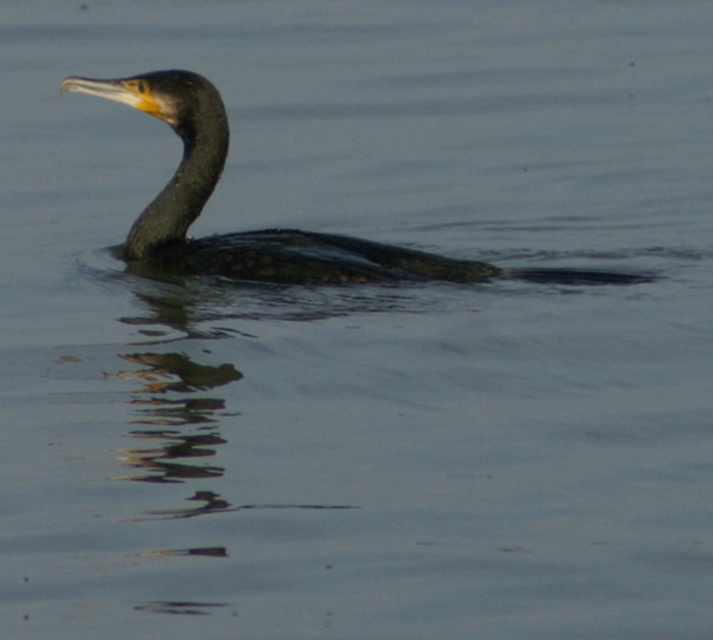
Question: Can you confirm if shiny black duck at center is wider than dark gray matte neck at center?

Choices:
 (A) no
 (B) yes

Answer: (B)

Question: Can you confirm if shiny black duck at center is positioned to the right of dark gray matte neck at center?

Choices:
 (A) yes
 (B) no

Answer: (A)

Question: Which point is closer to the camera taking this photo?

Choices:
 (A) (217, 134)
 (B) (225, 152)

Answer: (A)

Question: Does shiny black duck at center appear on the right side of dark gray matte neck at center?

Choices:
 (A) yes
 (B) no

Answer: (A)

Question: Which of the following is the farthest from the observer?

Choices:
 (A) tap(164, 244)
 (B) tap(178, 224)

Answer: (A)